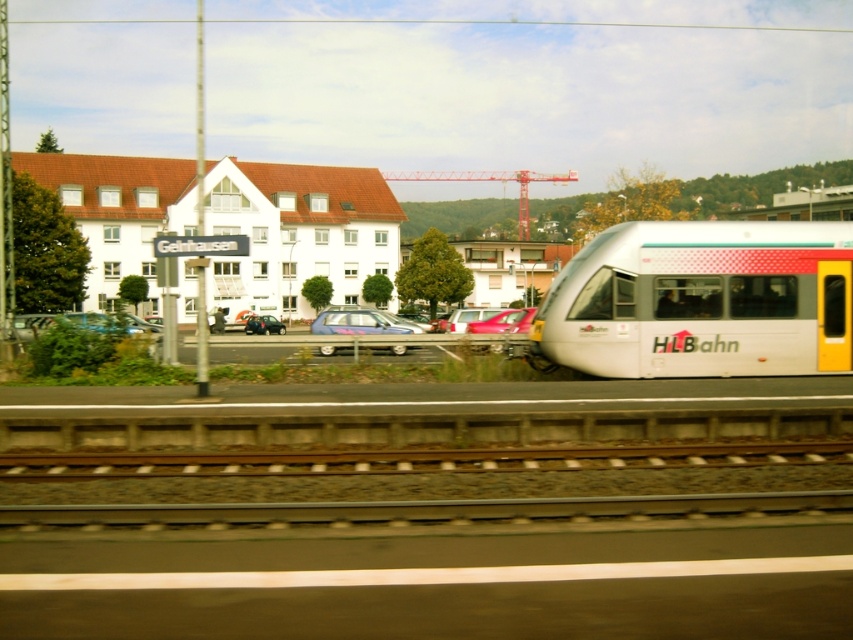
Question: Does white glossy train at right appear under matte black car at center?

Choices:
 (A) no
 (B) yes

Answer: (A)

Question: Is metallic silver car at center above matte black car at center?

Choices:
 (A) no
 (B) yes

Answer: (B)

Question: Which point appears closest to the camera in this image?

Choices:
 (A) (372, 317)
 (B) (273, 330)
 (C) (538, 346)

Answer: (C)

Question: Which point appears closest to the camera in this image?

Choices:
 (A) (730, 372)
 (B) (404, 348)

Answer: (A)

Question: Considering the real-world distances, which object is farthest from the shiny red sedan at center?

Choices:
 (A) metallic silver car at center
 (B) white glossy train at right

Answer: (B)

Question: Does shiny red sedan at center have a greater width compared to matte black car at center?

Choices:
 (A) no
 (B) yes

Answer: (A)